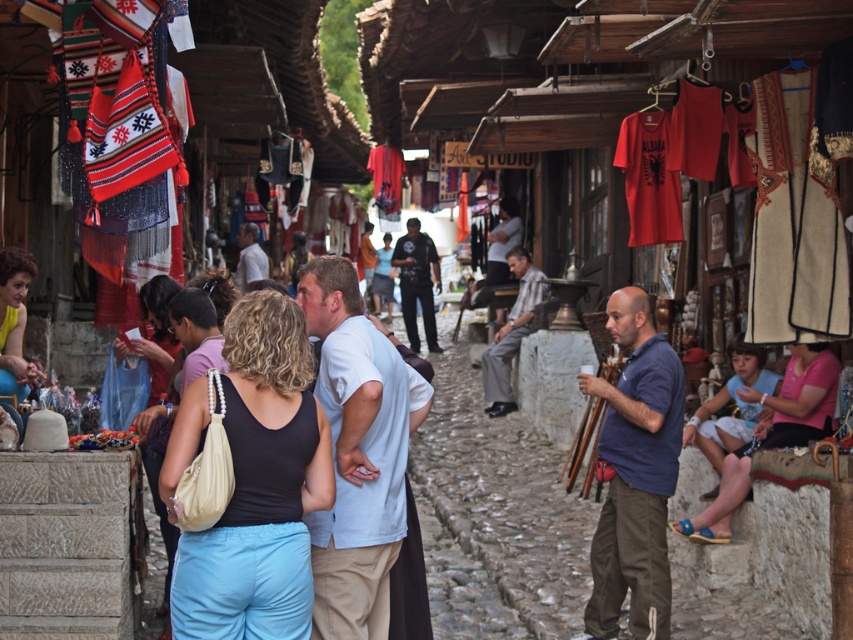
You are a customer at the market and want to buy both the black fabric tank top at center and the yellow fabric blouse at center. If you can only carry items within a 5 meter reach, can you grab both items without moving from your current position?

The distance between the black fabric tank top at center and the yellow fabric blouse at center is 4.87 meters, which is within your 5 meter reach. Therefore, you can grab both items without moving.

You are a customer at the market and want to buy a top that is wider than the other. Which one should you choose between the matte black tank top at center and the yellow fabric blouse at center?

The matte black tank top at center is wider than the yellow fabric blouse at center, so you should choose the matte black tank top at center.